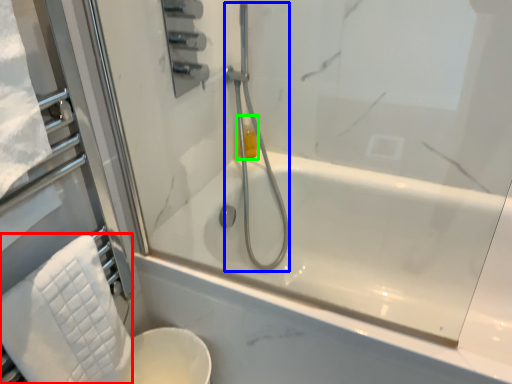
Question: Estimate the real-world distances between objects in this image. Which object is farther from bath towel (highlighted by a red box), shower (highlighted by a blue box) or toiletry (highlighted by a green box)?

Choices:
 (A) shower
 (B) toiletry

Answer: (B)